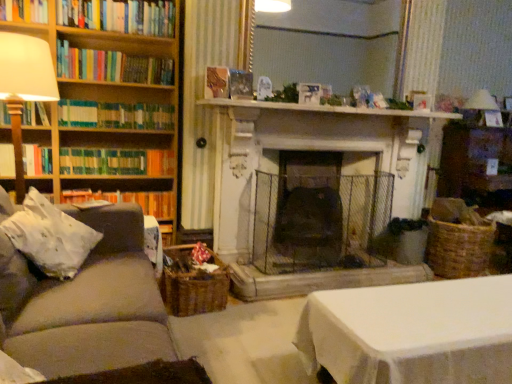
Image resolution: width=512 pixels, height=384 pixels. What do you see at coordinates (119, 16) in the screenshot?
I see `hardcover books at upper left, which is the eighth book in bottom-to-top order` at bounding box center [119, 16].

The height and width of the screenshot is (384, 512). Identify the location of matte white table lamp at upper right, which is the 2th table lamp from front to back. (481, 101).

Where is `hardcover book at left, which ranks as the fifth book in top-to-bottom order`? This screenshot has width=512, height=384. hardcover book at left, which ranks as the fifth book in top-to-bottom order is located at coordinates (34, 114).

Where is `dark gray stone fireplace at center`? dark gray stone fireplace at center is located at coordinates (309, 207).

Where is `woven brown basket at lower center`? The image size is (512, 384). woven brown basket at lower center is located at coordinates (193, 284).

From the picture: From the image's perspective, is gray fabric couch at left on green matte bookshelf at left, which is counted as the sixth book, starting from the top?

No, from the image's perspective, gray fabric couch at left is not on top of green matte bookshelf at left, which is counted as the sixth book, starting from the top.

Does gray fabric couch at left have a greater height compared to green matte bookshelf at left, arranged as the 3th book when ordered from the bottom?

Correct, gray fabric couch at left is much taller as green matte bookshelf at left, arranged as the 3th book when ordered from the bottom.

Looking at this image, does gray fabric couch at left appear on the right side of green matte bookshelf at left, arranged as the 3th book when ordered from the bottom?

Indeed, gray fabric couch at left is positioned on the right side of green matte bookshelf at left, arranged as the 3th book when ordered from the bottom.

Is gray fabric couch at left inside or outside of green matte bookshelf at left, which is counted as the sixth book, starting from the top?

gray fabric couch at left lies outside green matte bookshelf at left, which is counted as the sixth book, starting from the top.

From the image's perspective, is woven brown basket at lower center below dark gray stone fireplace at center?

Yes.

The height and width of the screenshot is (384, 512). Identify the location of basket that is under the dark gray stone fireplace at center (from a real-world perspective). (193, 284).

Considering the positions of objects woven brown basket at lower center and dark gray stone fireplace at center in the image provided, who is more to the left, woven brown basket at lower center or dark gray stone fireplace at center?

Positioned to the left is woven brown basket at lower center.

Based on the photo, would you say woven brown basket at lower center contains dark gray stone fireplace at center?

No.

Based on the photo, from a real-world perspective, who is located higher, hardcover book at left, acting as the 4th book starting from the bottom, or hardcover book at left, the 8th book positioned from the top?

hardcover book at left, acting as the 4th book starting from the bottom, from a real-world perspective.

Between hardcover book at left, acting as the 4th book starting from the bottom, and hardcover book at left, the 8th book positioned from the top, which one has larger size?

With larger size is hardcover book at left, the 8th book positioned from the top.

Considering the relative positions of hardcover book at left, acting as the 4th book starting from the bottom, and hardcover book at left, acting as the first book starting from the bottom, in the image provided, is hardcover book at left, acting as the 4th book starting from the bottom, behind hardcover book at left, acting as the first book starting from the bottom,?

No, hardcover book at left, acting as the 4th book starting from the bottom, is closer to the camera.

Is hardcover book at left, acting as the 4th book starting from the bottom, turned away from hardcover book at left, acting as the first book starting from the bottom?

No.

Does point (376, 108) come behind point (189, 313)?

Yes.

From a real-world perspective, who is located higher, white marble fireplace at center or woven brown basket at lower center?

white marble fireplace at center.

Is white marble fireplace at center positioned far away from woven brown basket at lower center?

That's right, there is a large distance between white marble fireplace at center and woven brown basket at lower center.

Looking at the image, does matte white lampshade at left, which ranks as the first table lamp in front-to-back order, seem bigger or smaller compared to hardcover books at left, which is counted as the 6th book, starting from the bottom?

matte white lampshade at left, which ranks as the first table lamp in front-to-back order, is bigger than hardcover books at left, which is counted as the 6th book, starting from the bottom.

Considering the sizes of objects matte white lampshade at left, which ranks as the first table lamp in front-to-back order, and hardcover books at left, which is counted as the 6th book, starting from the bottom, in the image provided, who is thinner, matte white lampshade at left, which ranks as the first table lamp in front-to-back order, or hardcover books at left, which is counted as the 6th book, starting from the bottom,?

hardcover books at left, which is counted as the 6th book, starting from the bottom.

Can you tell me how much matte white lampshade at left, the 1th table lamp in the left-to-right sequence, and hardcover books at left, which is the third book from top to bottom, differ in facing direction?

There is a 2.08-degree angle between the facing directions of matte white lampshade at left, the 1th table lamp in the left-to-right sequence, and hardcover books at left, which is the third book from top to bottom.

Is matte white lampshade at left, the second table lamp from the back, behind hardcover books at left, which is the third book from top to bottom?

No, matte white lampshade at left, the second table lamp from the back, is in front of hardcover books at left, which is the third book from top to bottom.

Which object is thinner, white marble fireplace at center or white fabric pillow at left?

Thinner between the two is white marble fireplace at center.

From a real-world perspective, relative to white fabric pillow at left, is white marble fireplace at center vertically above or below?

From a real-world perspective, white marble fireplace at center is physically above white fabric pillow at left.

From the image's perspective, which is below, white marble fireplace at center or white fabric pillow at left?

From the image's view, white fabric pillow at left is below.

Does white marble fireplace at center have a smaller size compared to white fabric pillow at left?

Correct, white marble fireplace at center occupies less space than white fabric pillow at left.

At what (x,y) coordinates should I click in order to perform the action: click on fireplace located in front of the matte white table lamp at upper right, which is the 2th table lamp from front to back. Please return your answer as a coordinate pair (x, y). This screenshot has width=512, height=384. Looking at the image, I should click on (309, 207).

Who is bigger, dark gray stone fireplace at center or matte white table lamp at upper right, marked as the first table lamp in a back-to-front arrangement?

dark gray stone fireplace at center.

Is dark gray stone fireplace at center wider than matte white table lamp at upper right, which is the 2th table lamp from front to back?

Yes.

This screenshot has width=512, height=384. I want to click on the 4th book to the left when counting from the gray fabric couch at left, so click(x=116, y=162).

This screenshot has height=384, width=512. Find the location of `fireplace located on the right of woven brown basket at lower center`. fireplace located on the right of woven brown basket at lower center is located at coordinates (309, 207).

Considering their positions, is wooden bookshelf at left positioned further to woven brown basket at lower center than matte white table lamp at upper right, marked as the first table lamp in a back-to-front arrangement?

The object further to woven brown basket at lower center is matte white table lamp at upper right, marked as the first table lamp in a back-to-front arrangement.

Considering their positions, is dark gray stone fireplace at center positioned closer to gray fabric couch at left than matte white table lamp at upper right, which appears as the second table lamp when viewed from the left?

dark gray stone fireplace at center is closer to gray fabric couch at left.

From the image, which object appears to be nearer to gray fabric couch at left, green matte bookshelf at upper left, which ranks as the 4th book in top-to-bottom order, or matte white lampshade at left, the second table lamp from the back?

matte white lampshade at left, the second table lamp from the back, is positioned closer to the anchor gray fabric couch at left.

Estimate the real-world distances between objects in this image. Which object is closer to green matte bookshelf at left, arranged as the 3th book when ordered from the bottom, hardcover book at upper left, the second book in the top-to-bottom sequence, or matte white lampshade at left, arranged as the second table lamp when viewed from the right?

matte white lampshade at left, arranged as the second table lamp when viewed from the right, lies closer to green matte bookshelf at left, arranged as the 3th book when ordered from the bottom, than the other object.

When comparing their distances from hardcover book at left, the 8th book positioned from the top, does hardcover books at left, which is the third book from top to bottom, or hardcover book at upper left, the second book in the top-to-bottom sequence, seem further?

hardcover book at upper left, the second book in the top-to-bottom sequence, is further to hardcover book at left, the 8th book positioned from the top.

Based on their spatial positions, is matte white table lamp at upper right, which appears as the second table lamp when viewed from the left, or hardcover book at left, the second book in the bottom-to-top sequence, closer to white fabric pillow at left?

Among the two, hardcover book at left, the second book in the bottom-to-top sequence, is located nearer to white fabric pillow at left.

Which object lies further to the anchor point hardcover book at left, the 8th book positioned from the top, matte white lampshade at left, the 1th table lamp in the left-to-right sequence, or hardcover book at left, acting as the 4th book starting from the bottom?

Among the two, matte white lampshade at left, the 1th table lamp in the left-to-right sequence, is located further to hardcover book at left, the 8th book positioned from the top.

Based on the photo, when comparing their distances from matte white table lamp at upper right, which is the 2th table lamp from front to back, does wooden bookshelf at left or hardcover books at left, which is counted as the 6th book, starting from the bottom, seem further?

wooden bookshelf at left is positioned further to the anchor matte white table lamp at upper right, which is the 2th table lamp from front to back.

The height and width of the screenshot is (384, 512). Find the location of `pillow positioned between gray fabric couch at left and hardcover book at left, arranged as the seventh book when viewed from the top, from near to far`. pillow positioned between gray fabric couch at left and hardcover book at left, arranged as the seventh book when viewed from the top, from near to far is located at coordinates (50, 236).

Locate an element on the screen. The width and height of the screenshot is (512, 384). basket located between gray fabric couch at left and green matte bookshelf at upper left, which ranks as the 4th book in top-to-bottom order, in the depth direction is located at coordinates (193, 284).

The width and height of the screenshot is (512, 384). In order to click on fireplace situated between matte white lampshade at left, arranged as the second table lamp when viewed from the right, and matte white table lamp at upper right, marked as the first table lamp in a back-to-front arrangement, from left to right in this screenshot , I will do `click(309, 207)`.

Where is `basket located between gray fabric couch at left and hardcover books at upper left, which is the eighth book in bottom-to-top order, in the depth direction`? basket located between gray fabric couch at left and hardcover books at upper left, which is the eighth book in bottom-to-top order, in the depth direction is located at coordinates (193, 284).